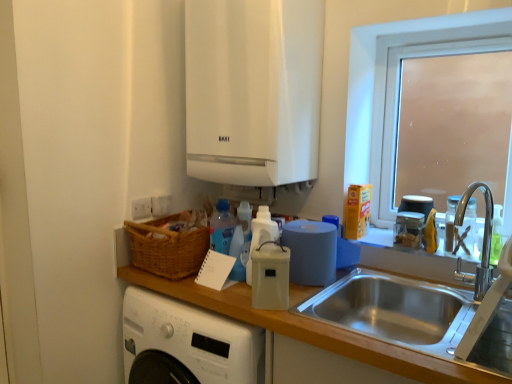
Question: From a real-world perspective, is stainless steel sink at lower right over clear plastic container at upper right, which appears as the second appliance when viewed from the right?

Choices:
 (A) yes
 (B) no

Answer: (B)

Question: Is stainless steel sink at lower right smaller than clear plastic container at upper right, positioned as the 2th appliance in left-to-right order?

Choices:
 (A) yes
 (B) no

Answer: (B)

Question: Are stainless steel sink at lower right and clear plastic container at upper right, positioned as the second appliance in back-to-front order, far apart?

Choices:
 (A) yes
 (B) no

Answer: (B)

Question: Considering the relative sizes of stainless steel sink at lower right and clear plastic container at upper right, positioned as the 2th appliance in left-to-right order, in the image provided, is stainless steel sink at lower right thinner than clear plastic container at upper right, positioned as the 2th appliance in left-to-right order,?

Choices:
 (A) no
 (B) yes

Answer: (A)

Question: Is stainless steel sink at lower right taller than clear plastic container at upper right, positioned as the 2th appliance in left-to-right order?

Choices:
 (A) yes
 (B) no

Answer: (A)

Question: Looking at their shapes, would you say blue matte paper towel at right is wider or thinner than white plastic bottle at center, the second bottle in the right-to-left sequence?

Choices:
 (A) thin
 (B) wide

Answer: (B)

Question: Choose the correct answer: Is blue matte paper towel at right inside white plastic bottle at center, the second bottle in the right-to-left sequence, or outside it?

Choices:
 (A) inside
 (B) outside

Answer: (B)

Question: In terms of height, does blue matte paper towel at right look taller or shorter compared to white plastic bottle at center, which is counted as the first bottle, starting from the left?

Choices:
 (A) short
 (B) tall

Answer: (A)

Question: From a real-world perspective, is blue matte paper towel at right positioned above or below white plastic bottle at center, which is counted as the first bottle, starting from the left?

Choices:
 (A) above
 (B) below

Answer: (B)

Question: From the image's perspective, relative to clear plastic container at upper right, positioned as the 2th appliance in left-to-right order, is translucent glass jar at upper right, arranged as the third appliance when viewed from the left, above or below?

Choices:
 (A) below
 (B) above

Answer: (B)

Question: In the image, is translucent glass jar at upper right, which ranks as the first appliance in right-to-left order, positioned in front of or behind clear plastic container at upper right, the 2th appliance viewed from the front?

Choices:
 (A) front
 (B) behind

Answer: (B)

Question: Considering the positions of translucent glass jar at upper right, marked as the 1th appliance in a back-to-front arrangement, and clear plastic container at upper right, the 2th appliance viewed from the front, in the image, is translucent glass jar at upper right, marked as the 1th appliance in a back-to-front arrangement, wider or thinner than clear plastic container at upper right, the 2th appliance viewed from the front,?

Choices:
 (A) thin
 (B) wide

Answer: (B)

Question: In terms of size, does translucent glass jar at upper right, marked as the 1th appliance in a back-to-front arrangement, appear bigger or smaller than clear plastic container at upper right, which appears as the second appliance when viewed from the right?

Choices:
 (A) big
 (B) small

Answer: (A)

Question: In terms of size, does clear plastic container at upper right, positioned as the 2th appliance in left-to-right order, appear bigger or smaller than white plastic bottle at center, the second bottle in the right-to-left sequence?

Choices:
 (A) big
 (B) small

Answer: (B)

Question: Considering the positions of clear plastic container at upper right, which appears as the second appliance when viewed from the right, and white plastic bottle at center, the second bottle in the right-to-left sequence, in the image, is clear plastic container at upper right, which appears as the second appliance when viewed from the right, wider or thinner than white plastic bottle at center, the second bottle in the right-to-left sequence,?

Choices:
 (A) wide
 (B) thin

Answer: (A)